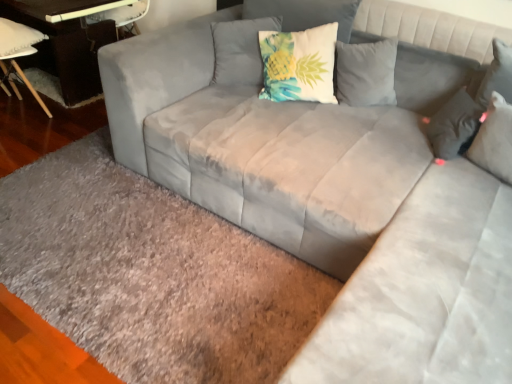
Question: Is the depth of gray shaggy rug at lower left less than that of suede gray pillow at upper right, marked as the 3th pillow in a left-to-right arrangement?

Choices:
 (A) no
 (B) yes

Answer: (B)

Question: Is suede gray pillow at upper right, marked as the 3th pillow in a left-to-right arrangement, surrounded by gray shaggy rug at lower left?

Choices:
 (A) no
 (B) yes

Answer: (A)

Question: Would you consider gray shaggy rug at lower left to be distant from suede gray pillow at upper right, marked as the 3th pillow in a left-to-right arrangement?

Choices:
 (A) no
 (B) yes

Answer: (B)

Question: Is gray shaggy rug at lower left directly adjacent to suede gray pillow at upper right, which is the first pillow from right to left?

Choices:
 (A) yes
 (B) no

Answer: (B)

Question: From a real-world perspective, is gray shaggy rug at lower left on top of suede gray pillow at upper right, marked as the 3th pillow in a left-to-right arrangement?

Choices:
 (A) yes
 (B) no

Answer: (B)

Question: From a real-world perspective, is gray shaggy rug at lower left below suede gray pillow at upper right, marked as the 3th pillow in a left-to-right arrangement?

Choices:
 (A) no
 (B) yes

Answer: (B)

Question: Is teal fabric pillow at upper center, acting as the third pillow starting from the right, to the right of suede gray pillow at upper right, marked as the 3th pillow in a left-to-right arrangement, from the viewer's perspective?

Choices:
 (A) no
 (B) yes

Answer: (A)

Question: Is teal fabric pillow at upper center, the first pillow positioned from the left, completely or partially outside of suede gray pillow at upper right, which is the first pillow from right to left?

Choices:
 (A) no
 (B) yes

Answer: (B)

Question: Could you tell me if teal fabric pillow at upper center, acting as the third pillow starting from the right, is facing suede gray pillow at upper right, marked as the 3th pillow in a left-to-right arrangement?

Choices:
 (A) no
 (B) yes

Answer: (A)

Question: Does teal fabric pillow at upper center, acting as the third pillow starting from the right, come behind suede gray pillow at upper right, marked as the 3th pillow in a left-to-right arrangement?

Choices:
 (A) no
 (B) yes

Answer: (B)

Question: From the image's perspective, is teal fabric pillow at upper center, acting as the third pillow starting from the right, on top of suede gray pillow at upper right, which is the first pillow from right to left?

Choices:
 (A) no
 (B) yes

Answer: (B)

Question: Considering the relative sizes of teal fabric pillow at upper center, acting as the third pillow starting from the right, and suede gray pillow at upper right, marked as the 3th pillow in a left-to-right arrangement, in the image provided, is teal fabric pillow at upper center, acting as the third pillow starting from the right, smaller than suede gray pillow at upper right, marked as the 3th pillow in a left-to-right arrangement,?

Choices:
 (A) yes
 (B) no

Answer: (B)

Question: Could gray shaggy rug at lower left be considered to be inside dark brown wood table at left?

Choices:
 (A) yes
 (B) no

Answer: (B)